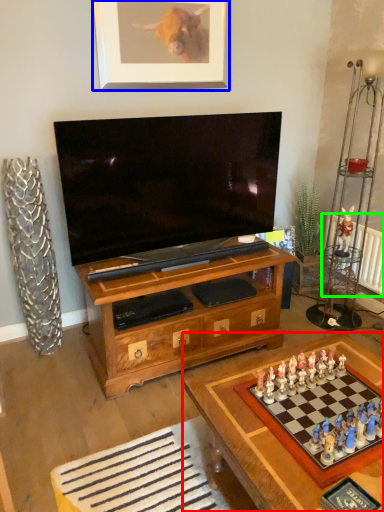
Question: Which is nearer to the table (highlighted by a red box)? picture frame (highlighted by a blue box) or radiator (highlighted by a green box).

Choices:
 (A) picture frame
 (B) radiator

Answer: (B)